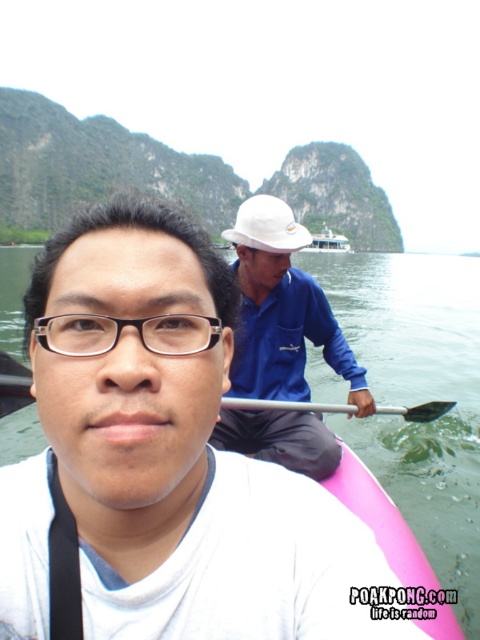
You are a photographer trying to capture the matte white helmet at upper center and the silver metallic paddle at center in the same frame. Which object should you focus on first to ensure both are in the shot?

You should focus on the matte white helmet at upper center first because it is larger than the silver metallic paddle at center, making it easier to center and frame properly.